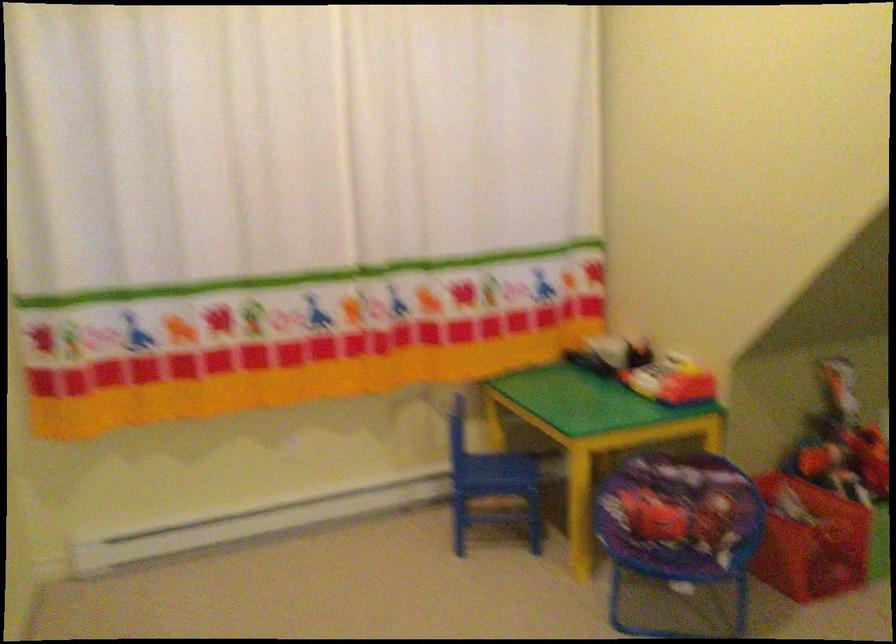
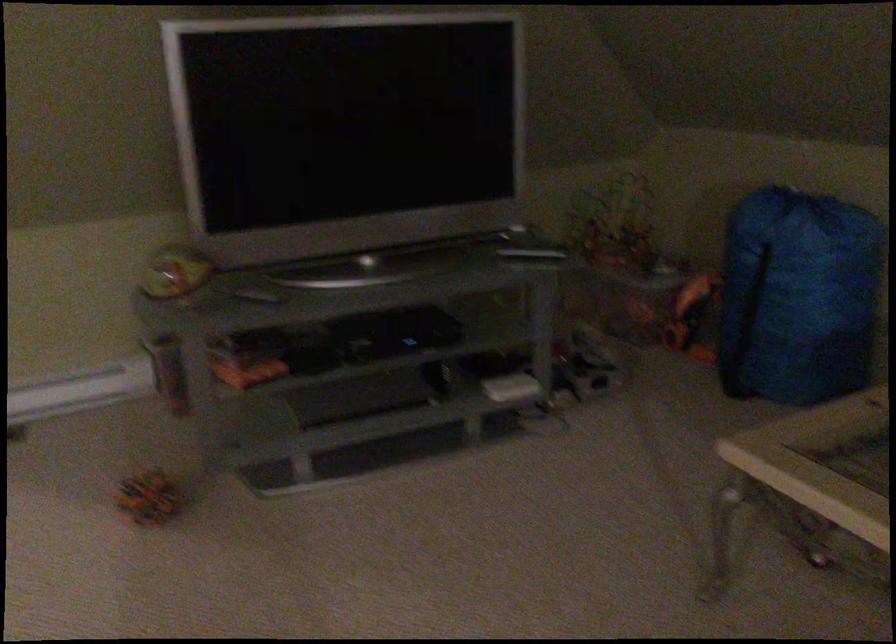
Question: In a continuous first-person perspective shot, in which direction is the camera moving?

Choices:
 (A) Left
 (B) Right
 (C) Forward
 (D) Backward

Answer: (B)